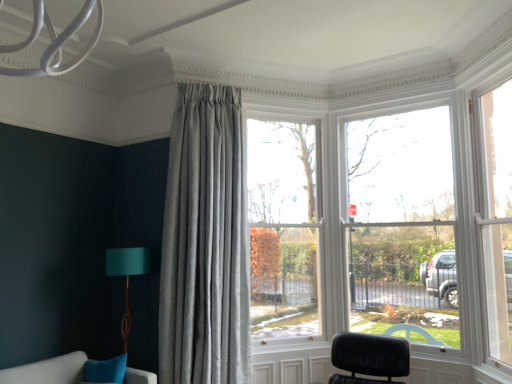
Question: From a real-world perspective, is teal fabric lampshade at lower left located beneath clear glass window at center?

Choices:
 (A) yes
 (B) no

Answer: (A)

Question: Can you confirm if teal fabric lampshade at lower left is thinner than clear glass window at center?

Choices:
 (A) no
 (B) yes

Answer: (A)

Question: Is teal fabric lampshade at lower left taller than clear glass window at center?

Choices:
 (A) no
 (B) yes

Answer: (A)

Question: Is the depth of teal fabric lampshade at lower left greater than that of clear glass window at center?

Choices:
 (A) no
 (B) yes

Answer: (A)

Question: Considering the relative sizes of teal fabric lampshade at lower left and clear glass window at center in the image provided, is teal fabric lampshade at lower left bigger than clear glass window at center?

Choices:
 (A) no
 (B) yes

Answer: (A)

Question: Considering the relative sizes of teal fabric lampshade at lower left and clear glass window at center in the image provided, is teal fabric lampshade at lower left wider than clear glass window at center?

Choices:
 (A) yes
 (B) no

Answer: (A)

Question: Is satin grey curtain at center facing away from teal fabric lampshade at lower left?

Choices:
 (A) no
 (B) yes

Answer: (A)

Question: Does satin grey curtain at center have a lesser height compared to teal fabric lampshade at lower left?

Choices:
 (A) yes
 (B) no

Answer: (B)

Question: Does satin grey curtain at center have a greater width compared to teal fabric lampshade at lower left?

Choices:
 (A) yes
 (B) no

Answer: (A)

Question: Are satin grey curtain at center and teal fabric lampshade at lower left making contact?

Choices:
 (A) no
 (B) yes

Answer: (A)

Question: From the image's perspective, does satin grey curtain at center appear lower than teal fabric lampshade at lower left?

Choices:
 (A) no
 (B) yes

Answer: (A)

Question: Is the position of satin grey curtain at center more distant than that of teal fabric lampshade at lower left?

Choices:
 (A) no
 (B) yes

Answer: (A)

Question: Can you confirm if clear glass window at center is wider than satin grey curtain at center?

Choices:
 (A) no
 (B) yes

Answer: (A)